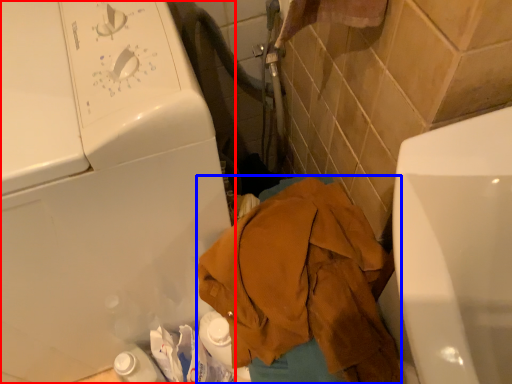
Question: Which object appears closest to the camera in this image, washing machine (highlighted by a red box) or clothing (highlighted by a blue box)?

Choices:
 (A) washing machine
 (B) clothing

Answer: (A)